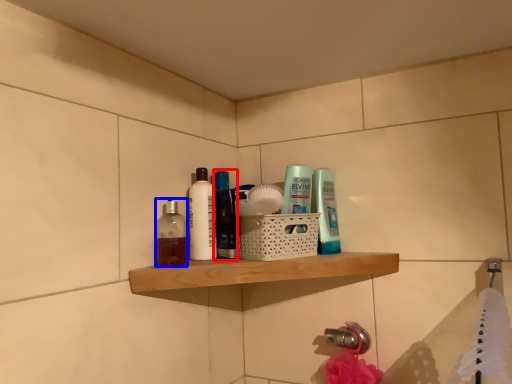
Question: Which point is closer to the camera, mouthwash (highlighted by a red box) or mouthwash (highlighted by a blue box)?

Choices:
 (A) mouthwash
 (B) mouthwash

Answer: (B)